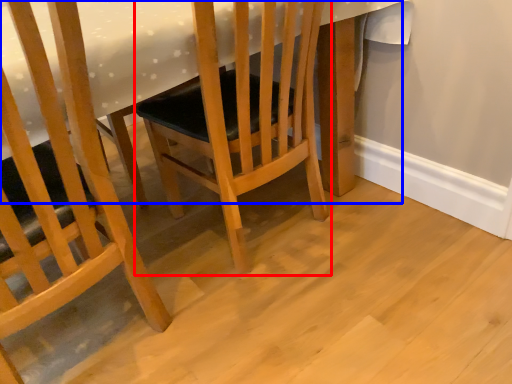
Question: Which object appears farthest to the camera in this image, chair (highlighted by a red box) or table (highlighted by a blue box)?

Choices:
 (A) chair
 (B) table

Answer: (A)